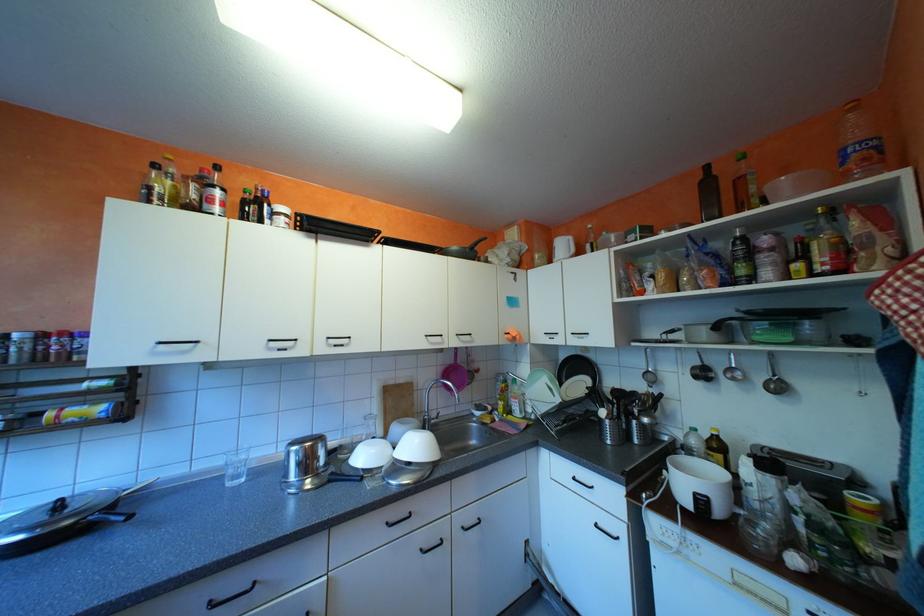
Where would you grasp the blender pitcher? Please return your answer as a coordinate pair (x, y).

(763, 506)